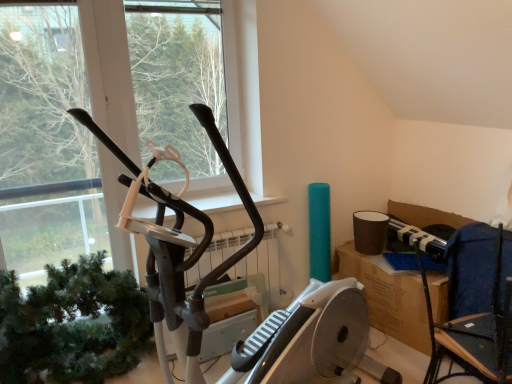
This screenshot has width=512, height=384. What do you see at coordinates (72, 324) in the screenshot?
I see `green matte plant at left` at bounding box center [72, 324].

Describe the element at coordinates (480, 320) in the screenshot. I see `dark blue fabric chair at right` at that location.

Locate an element on the screen. black matte elliptical machine at center is located at coordinates coord(177,76).

The width and height of the screenshot is (512, 384). What do you see at coordinates (177, 76) in the screenshot?
I see `black matte elliptical machine at center` at bounding box center [177, 76].

Locate an element on the screen. Image resolution: width=512 pixels, height=384 pixels. black matte stationary bicycle at left is located at coordinates (177, 241).

Based on their positions, is green matte plant at left located to the left or right of dark blue fabric chair at right?

green matte plant at left is positioned on dark blue fabric chair at right's left side.

At what (x,y) coordinates should I click in order to perform the action: click on plant behind the dark blue fabric chair at right. Please return your answer as a coordinate pair (x, y). The width and height of the screenshot is (512, 384). Looking at the image, I should click on click(x=72, y=324).

In the scene shown: Is green matte plant at left looking in the opposite direction of dark blue fabric chair at right?

No.

Is black matte stationary bicycle at left bigger than dark blue fabric chair at right?

Yes, black matte stationary bicycle at left is bigger than dark blue fabric chair at right.

Looking at this image, in terms of height, does black matte stationary bicycle at left look taller or shorter compared to dark blue fabric chair at right?

black matte stationary bicycle at left is taller than dark blue fabric chair at right.

From a real-world perspective, is black matte stationary bicycle at left physically above dark blue fabric chair at right?

Indeed, from a real-world perspective, black matte stationary bicycle at left stands above dark blue fabric chair at right.

Are black matte stationary bicycle at left and dark blue fabric chair at right located far from each other?

Yes.

Which object is positioned more to the right, green matte plant at left or black matte stationary bicycle at left?

Positioned to the right is black matte stationary bicycle at left.

Could black matte stationary bicycle at left be considered to be inside green matte plant at left?

Definitely not — black matte stationary bicycle at left is not inside green matte plant at left.

Considering the relative sizes of green matte plant at left and black matte stationary bicycle at left in the image provided, is green matte plant at left shorter than black matte stationary bicycle at left?

Indeed, green matte plant at left has a lesser height compared to black matte stationary bicycle at left.

Can you confirm if green matte plant at left is bigger than black matte stationary bicycle at left?

Incorrect, green matte plant at left is not larger than black matte stationary bicycle at left.

Is point (238, 379) positioned after point (113, 310)?

No, it is not.

From a real-world perspective, is black matte stationary bicycle at left physically above green matte plant at left?

Yes, from a real-world perspective, black matte stationary bicycle at left is above green matte plant at left.

Is black matte stationary bicycle at left positioned with its back to green matte plant at left?

No, black matte stationary bicycle at left's orientation is not away from green matte plant at left.

Does black matte stationary bicycle at left contain green matte plant at left?

Actually, green matte plant at left is outside black matte stationary bicycle at left.

Which is more to the left, black matte elliptical machine at center or black matte stationary bicycle at left?

black matte elliptical machine at center is more to the left.

From a real-world perspective, between black matte elliptical machine at center and black matte stationary bicycle at left, who is vertically lower?

In real-world perspective, black matte stationary bicycle at left is lower.

Which is in front, point (191, 133) or point (300, 367)?

Positioned in front is point (300, 367).

How different are the orientations of black matte stationary bicycle at left and black matte elliptical machine at center in degrees?

There is a 70.6-degree angle between the facing directions of black matte stationary bicycle at left and black matte elliptical machine at center.

How distant is black matte stationary bicycle at left from black matte elliptical machine at center?

A distance of 1.29 meters exists between black matte stationary bicycle at left and black matte elliptical machine at center.

Which of these two, black matte stationary bicycle at left or black matte elliptical machine at center, is smaller?

black matte elliptical machine at center.

Which object is further away from the camera, black matte stationary bicycle at left or black matte elliptical machine at center?

black matte elliptical machine at center is behind.

Which object is positioned more to the right, dark blue fabric chair at right or black matte elliptical machine at center?

dark blue fabric chair at right is more to the right.

Who is bigger, dark blue fabric chair at right or black matte elliptical machine at center?

With larger size is dark blue fabric chair at right.

Is dark blue fabric chair at right wider or thinner than black matte elliptical machine at center?

Clearly, dark blue fabric chair at right has more width compared to black matte elliptical machine at center.

Considering the sizes of objects dark blue fabric chair at right and black matte elliptical machine at center in the image provided, who is taller, dark blue fabric chair at right or black matte elliptical machine at center?

black matte elliptical machine at center.

Where is `chair lying on the right of green matte plant at left`? chair lying on the right of green matte plant at left is located at coordinates (480, 320).

Locate an element on the screen. The height and width of the screenshot is (384, 512). chair lying below the black matte stationary bicycle at left (from the image's perspective) is located at coordinates (480, 320).

Estimate the real-world distances between objects in this image. Which object is further from green matte plant at left, black matte elliptical machine at center or black matte stationary bicycle at left?

black matte elliptical machine at center is positioned further to the anchor green matte plant at left.

When comparing their distances from black matte elliptical machine at center, does green matte plant at left or black matte stationary bicycle at left seem further?

Based on the image, black matte stationary bicycle at left appears to be further to black matte elliptical machine at center.

From the image, which object appears to be nearer to black matte stationary bicycle at left, black matte elliptical machine at center or dark blue fabric chair at right?

Based on the image, black matte elliptical machine at center appears to be nearer to black matte stationary bicycle at left.

From the image, which object appears to be farther from black matte stationary bicycle at left, black matte elliptical machine at center or green matte plant at left?

black matte elliptical machine at center.

Considering their positions, is green matte plant at left positioned further to dark blue fabric chair at right than black matte stationary bicycle at left?

green matte plant at left.

Looking at the image, which one is located further to dark blue fabric chair at right, black matte stationary bicycle at left or green matte plant at left?

green matte plant at left lies further to dark blue fabric chair at right than the other object.

Which object lies nearer to the anchor point dark blue fabric chair at right, green matte plant at left or black matte elliptical machine at center?

green matte plant at left is closer to dark blue fabric chair at right.

Based on their spatial positions, is black matte stationary bicycle at left or green matte plant at left closer to black matte elliptical machine at center?

The object closer to black matte elliptical machine at center is green matte plant at left.

Where is `window screen located between green matte plant at left and dark blue fabric chair at right in the left-right direction`? The image size is (512, 384). window screen located between green matte plant at left and dark blue fabric chair at right in the left-right direction is located at coordinates (177, 76).

At what (x,y) coordinates should I click in order to perform the action: click on plant between black matte stationary bicycle at left and black matte elliptical machine at center in the front-back direction. Please return your answer as a coordinate pair (x, y). The height and width of the screenshot is (384, 512). Looking at the image, I should click on (72, 324).

What are the coordinates of `stationary bicycle between black matte elliptical machine at center and dark blue fabric chair at right in the horizontal direction` in the screenshot? It's located at (177, 241).

Locate an element on the screen. The image size is (512, 384). stationary bicycle between green matte plant at left and dark blue fabric chair at right from left to right is located at coordinates (177, 241).